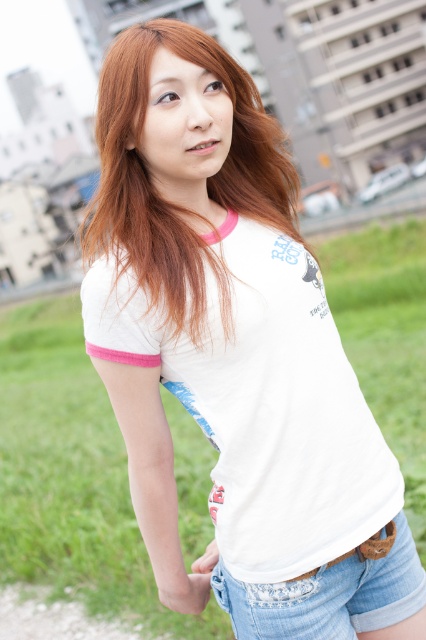
Question: Which point appears farthest from the camera in this image?

Choices:
 (A) (293, 580)
 (B) (118, 243)

Answer: (A)

Question: Does blonde hair at center appear under denim shorts at lower right?

Choices:
 (A) no
 (B) yes

Answer: (A)

Question: Which object is closer to the camera taking this photo?

Choices:
 (A) blonde hair at center
 (B) denim shorts at lower right

Answer: (A)

Question: Is blonde hair at center wider than denim shorts at lower right?

Choices:
 (A) yes
 (B) no

Answer: (A)

Question: Does blonde hair at center appear under denim shorts at lower right?

Choices:
 (A) no
 (B) yes

Answer: (A)